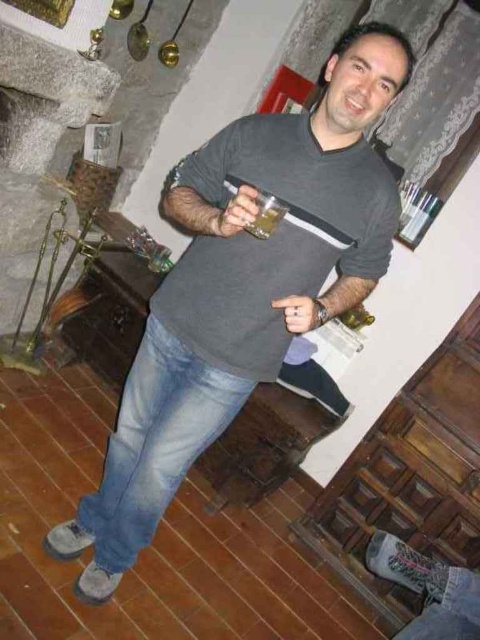
Where is `gray matte t-shirt at center`? The height and width of the screenshot is (640, 480). gray matte t-shirt at center is located at coordinates (242, 289).

Is point (369, 120) closer to camera compared to point (261, 216)?

No, (369, 120) is further to viewer.

The width and height of the screenshot is (480, 640). What are the coordinates of `gray matte t-shirt at center` in the screenshot? It's located at (242, 289).

Is matte plastic cup at center to the right of translucent glass at upper center from the viewer's perspective?

No, matte plastic cup at center is not to the right of translucent glass at upper center.

Between matte plastic cup at center and translucent glass at upper center, which one appears on the left side from the viewer's perspective?

Positioned to the left is matte plastic cup at center.

Image resolution: width=480 pixels, height=640 pixels. I want to click on matte plastic cup at center, so click(237, 212).

The height and width of the screenshot is (640, 480). Identify the location of matte plastic cup at center. (237, 212).

Does matte plastic cup at center appear on the left side of matte gray hand at center?

Indeed, matte plastic cup at center is positioned on the left side of matte gray hand at center.

Measure the distance between matte plastic cup at center and camera.

A distance of 4.01 feet exists between matte plastic cup at center and camera.

Where is `matte plastic cup at center`? This screenshot has width=480, height=640. matte plastic cup at center is located at coordinates (237, 212).